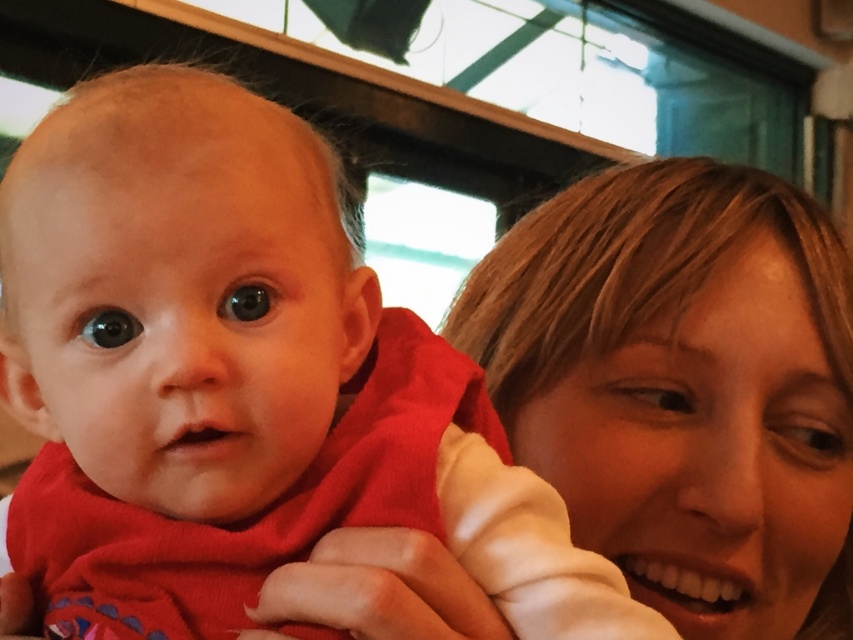
Question: Among these points, which one is nearest to the camera?

Choices:
 (A) (207, 378)
 (B) (549, 452)

Answer: (A)

Question: Among these objects, which one is nearest to the camera?

Choices:
 (A) red soft baby at center
 (B) smooth blonde hair at right

Answer: (A)

Question: Is red soft baby at center bigger than smooth blonde hair at right?

Choices:
 (A) no
 (B) yes

Answer: (B)

Question: Does red soft baby at center appear on the right side of smooth blonde hair at right?

Choices:
 (A) no
 (B) yes

Answer: (A)

Question: Is red soft baby at center above smooth blonde hair at right?

Choices:
 (A) no
 (B) yes

Answer: (A)